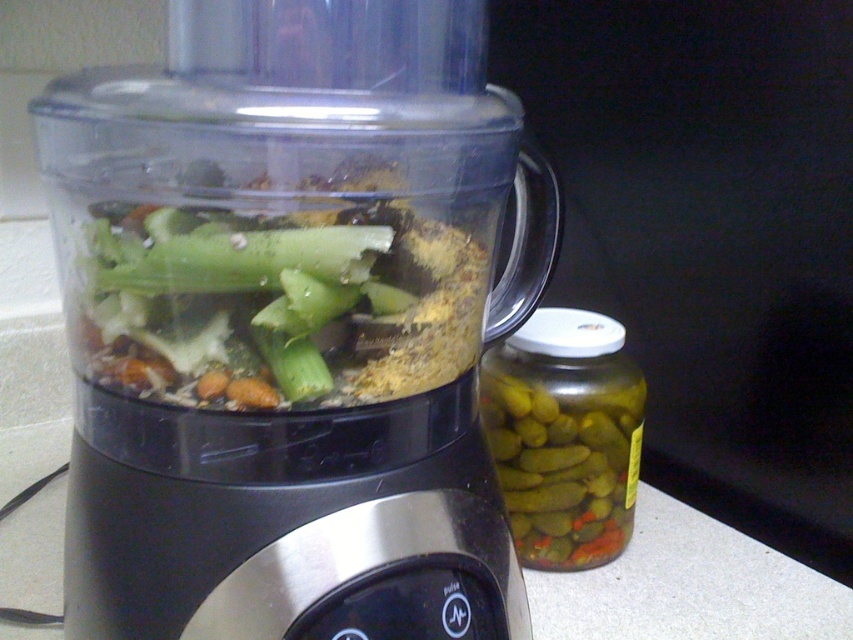
Which of these two, transparent plastic food processor at center or green glass jar at right, stands shorter?

green glass jar at right is shorter.

Does transparent plastic food processor at center have a lesser width compared to green glass jar at right?

In fact, transparent plastic food processor at center might be wider than green glass jar at right.

This screenshot has width=853, height=640. I want to click on transparent plastic food processor at center, so click(270, 324).

Locate an element on the screen. This screenshot has height=640, width=853. transparent plastic food processor at center is located at coordinates (270, 324).

Can you confirm if transparent plastic food processor at center is smaller than green matte vegetable at center?

No, transparent plastic food processor at center is not smaller than green matte vegetable at center.

Does transparent plastic food processor at center appear on the left side of green matte vegetable at center?

No, transparent plastic food processor at center is not to the left of green matte vegetable at center.

At what (x,y) coordinates should I click in order to perform the action: click on transparent plastic food processor at center. Please return your answer as a coordinate pair (x, y). Looking at the image, I should click on (270, 324).

Is green matte vegetable at center closer to the viewer compared to green glass jar at right?

Yes, it is.

Does green matte vegetable at center appear on the right side of green glass jar at right?

No, green matte vegetable at center is not to the right of green glass jar at right.

Between point (397, 328) and point (553, 384), which one is positioned behind?

The point (553, 384) is behind.

You are a GUI agent. You are given a task and a screenshot of the screen. Output one action in this format:
    pyautogui.click(x=<x>, y=<y>)
    Task: Click on the green matte vegetable at center
    The height and width of the screenshot is (640, 853).
    Given the screenshot: What is the action you would take?
    pyautogui.click(x=281, y=301)